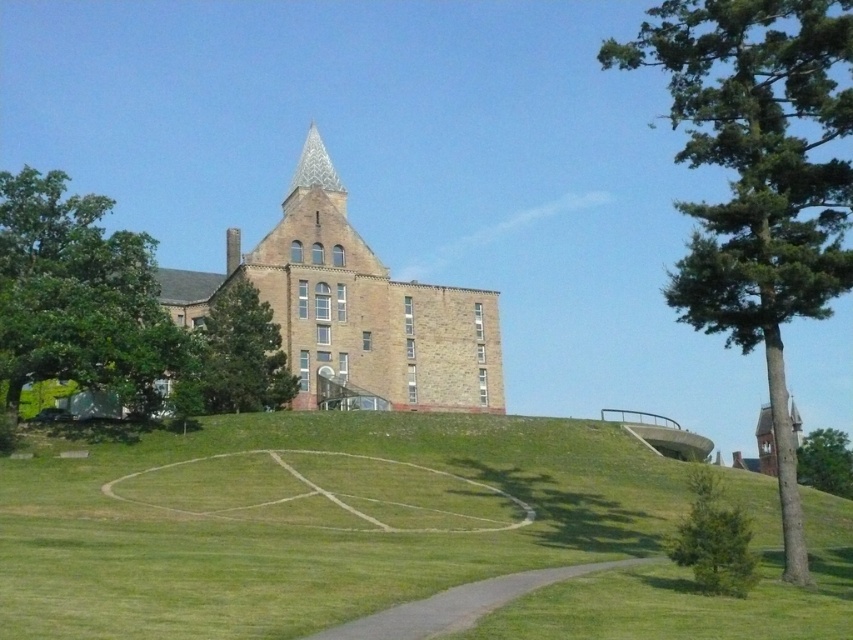
You are standing at the base of the hill looking up at the brown stone tower at center and the polished stone spire at upper center. Which structure would appear larger to you?

The brown stone tower at center appears larger because it is closer to the viewer than the polished stone spire at upper center.

You are an architect analyzing the building layout. Based on the scene, which object among the brown stone tower at center and the polished stone spire at upper center occupies a larger physical space?

The brown stone tower at center is bigger than the polished stone spire at upper center, so it occupies a larger physical space.

Consider the image. You are a landscape architect assessing the space between the green leafy tree at right and the polished stone spire at upper center. Which object takes up more horizontal space in the scene?

The green leafy tree at right takes up more horizontal space in the scene since its width is larger than that of the polished stone spire at upper center.